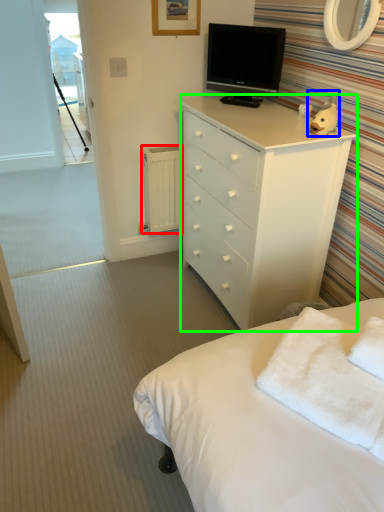
Question: Based on their relative distances, which object is nearer to radiator (highlighted by a red box)? Choose from toy (highlighted by a blue box) and chest of drawers (highlighted by a green box).

Choices:
 (A) toy
 (B) chest of drawers

Answer: (B)